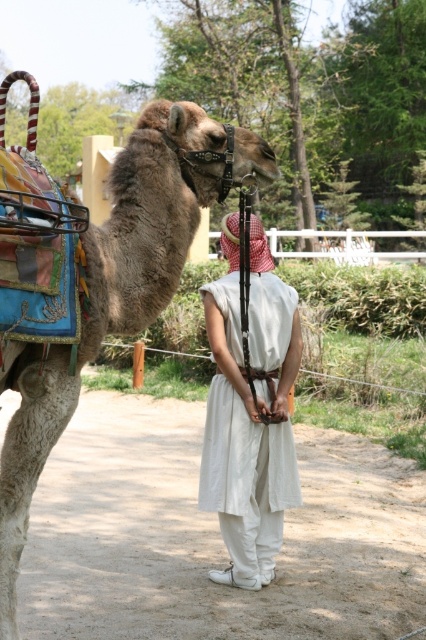
Which is more to the right, fuzzy beige camel at center or white cotton dress at center?

white cotton dress at center

Locate an element on the screen. The height and width of the screenshot is (640, 426). fuzzy beige camel at center is located at coordinates (115, 291).

Is point (108, 221) closer to camera compared to point (261, 332)?

Yes.

Find the location of a particular element. This screenshot has height=640, width=426. fuzzy beige camel at center is located at coordinates (115, 291).